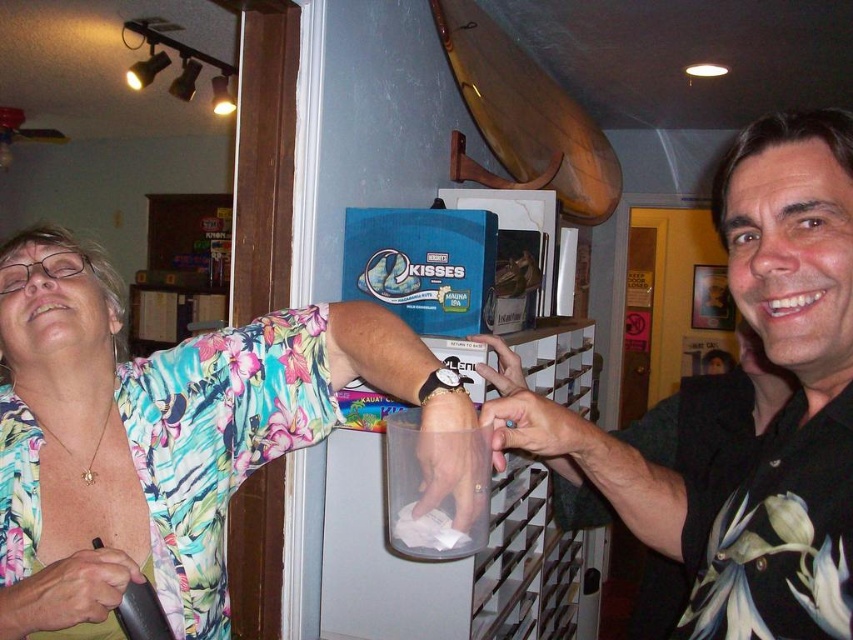
Measure the distance between point (70, 637) and camera.

Point (70, 637) and camera are 98.55 centimeters apart from each other.

Which is in front, point (206, 628) or point (744, 561)?

Positioned in front is point (744, 561).

Is point (47, 484) positioned behind point (769, 237)?

Yes, point (47, 484) is behind point (769, 237).

This screenshot has width=853, height=640. What are the coordinates of `floral fabric shirt at upper left` in the screenshot? It's located at (160, 435).